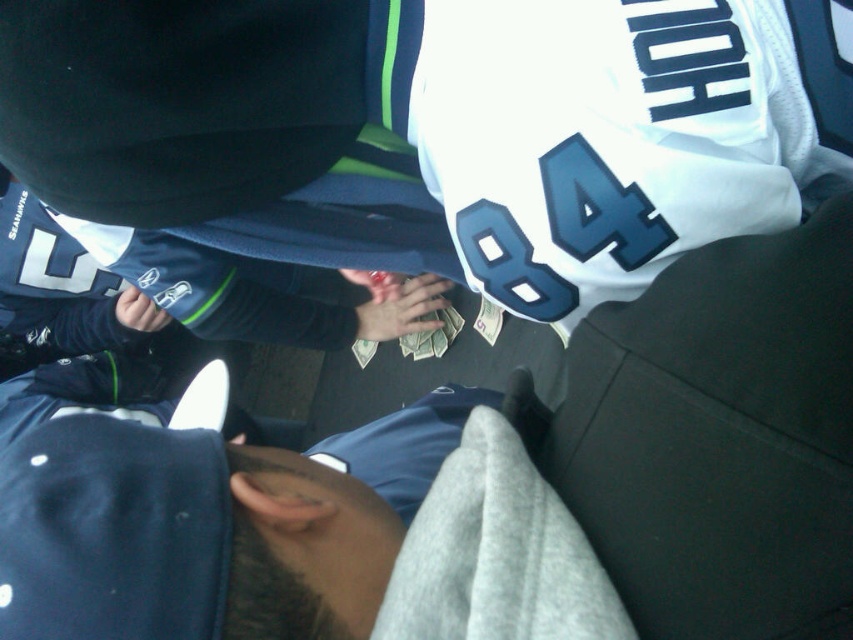
You are a photographer at a Seahawks game. You need to capture a photo of the white jersey at upper center and the dark blue fabric at center. Which object should you focus on first if you want to include both in the frame without moving the camera?

The white jersey at upper center is above the dark blue fabric at center, so you should focus on the white jersey at upper center first to ensure both are in the frame without moving the camera.

You are a photographer trying to capture both the white jersey at upper center and the dark blue fabric at center in your shot. Which object should you focus on first if you want to ensure both are in frame without moving the camera?

The white jersey at upper center has a larger width than the dark blue fabric at center, so focusing on the white jersey at upper center first will help ensure both are in frame since it occupies more space.

You are a photographer at a sports event. You need to capture a clear photo of both the white jersey at upper center and the dark blue fabric at center. Given their sizes, which object should you focus on first to ensure it is in frame?

The white jersey at upper center should be focused on first because it has a larger size compared to the dark blue fabric at center, so it will require more attention to ensure it is fully in frame.